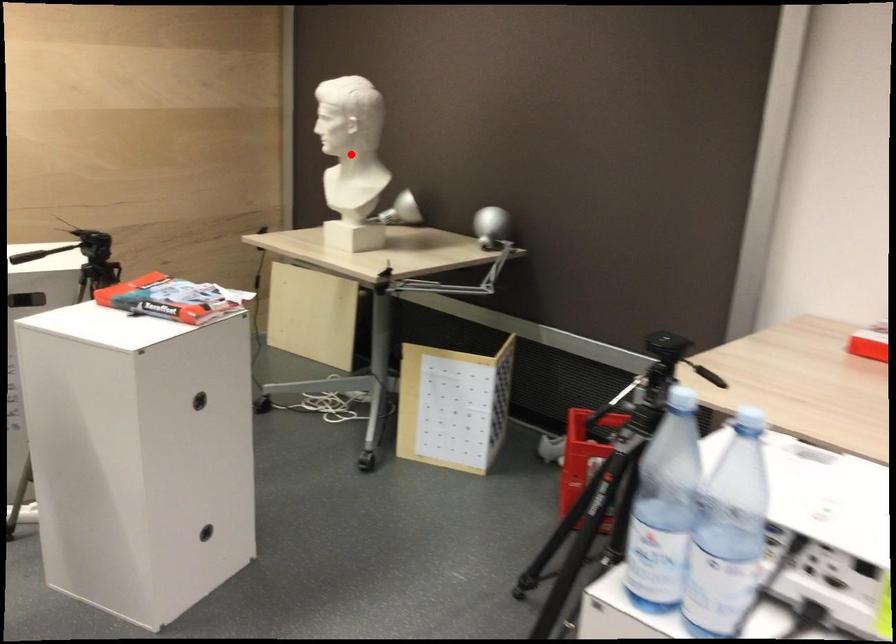
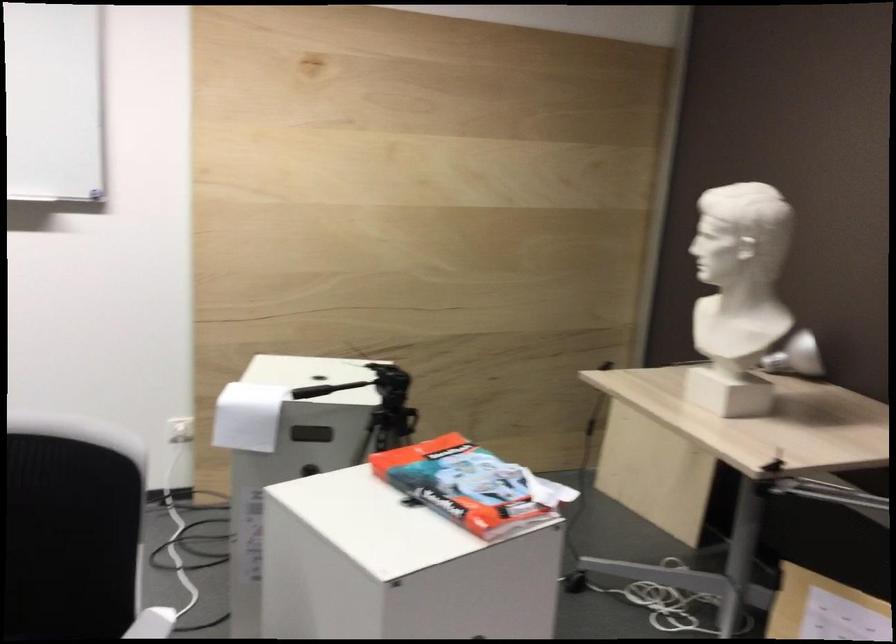
Question: I am providing you with two images of the same scene from different viewpoints. A red point is shown in image1. For the corresponding object point in image2, is it positioned nearer or farther from the camera?

Choices:
 (A) Nearer
 (B) Farther

Answer: (A)